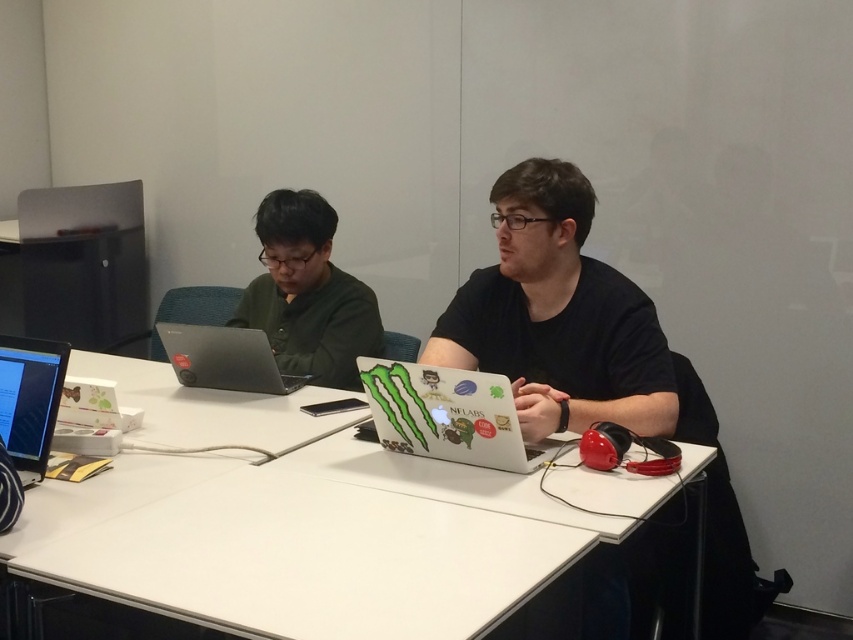
Does green matte laptop at center have a greater height compared to black glossy laptop at lower left?

Yes.

Identify the location of green matte laptop at center. The image size is (853, 640). (308, 292).

Who is positioned more to the right, black matte shirt at center or black glossy laptop at lower left?

black matte shirt at center is more to the right.

Who is more forward, (659, 400) or (49, 369)?

Positioned in front is point (49, 369).

Which is behind, point (621, 280) or point (38, 444)?

Point (621, 280)

Image resolution: width=853 pixels, height=640 pixels. I want to click on black matte shirt at center, so click(x=556, y=316).

From the picture: Is green matte laptop at center bigger than silver metallic laptop at center?

Yes, green matte laptop at center is bigger than silver metallic laptop at center.

Who is more distant from viewer, (283, 196) or (201, 337)?

Point (283, 196)

Image resolution: width=853 pixels, height=640 pixels. In order to click on green matte laptop at center in this screenshot , I will do `click(308, 292)`.